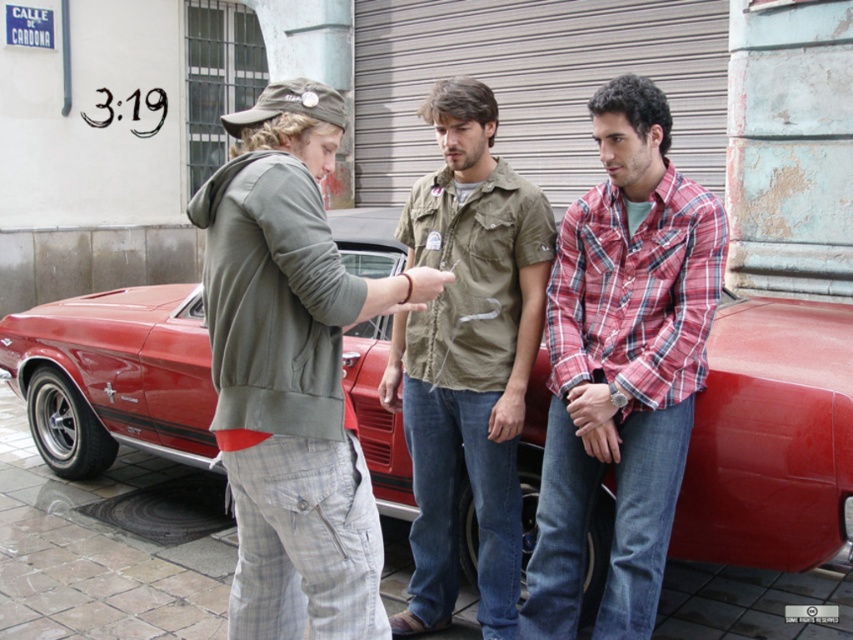
Looking at this image, you are a photographer trying to capture a photo of the shiny red car at center and the plaid cotton shirt at right. Since you want to emphasize the car, which object should you place closer to the camera to make it appear bigger in the photo?

To make the shiny red car at center appear bigger in the photo, you should place it closer to the camera since it already has a larger size compared to the plaid cotton shirt at right.

You are a photographer planning to take a group photo of the three people in front of the shiny red car at center. The khaki cotton shirt at center is 1.5 meters wide. Can the car accommodate all three people standing side by side without overlapping?

The shiny red car at center is wider than the khaki cotton shirt at center, which is 1.5 meters wide. Therefore, the car should be wide enough to fit all three people standing side by side without overlapping.

You are a photographer trying to capture a group photo of the plaid cotton shirt at right and the khaki cotton shirt at center. Since you want to ensure both are visible, which one should you focus on to frame the shot properly?

You should focus on framing the khaki cotton shirt at center because it occupies more space and will be easier to see in the photo.